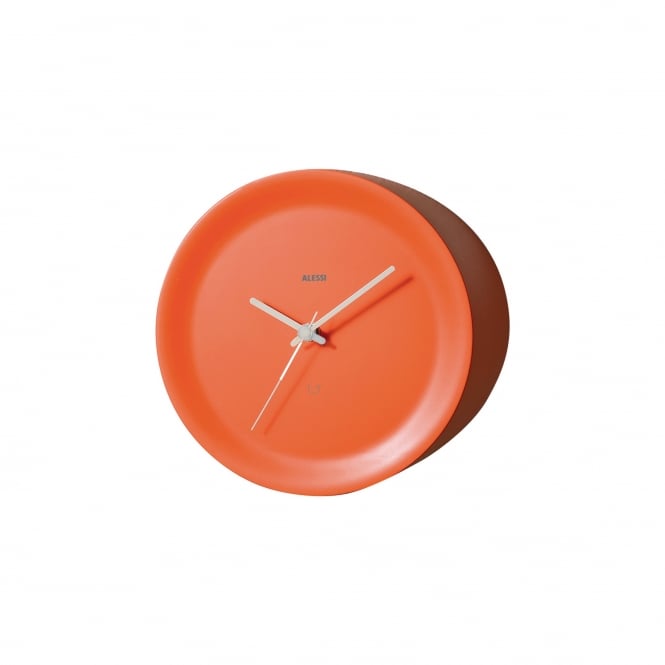
Where is `clock hands`? The image size is (665, 665). clock hands is located at coordinates (287, 368), (364, 292), (287, 318).